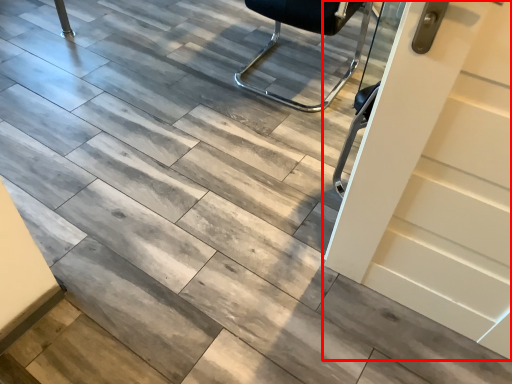
Question: From the image, what is the correct spatial relationship of door (annotated by the red box) in relation to chair?

Choices:
 (A) left
 (B) right

Answer: (B)